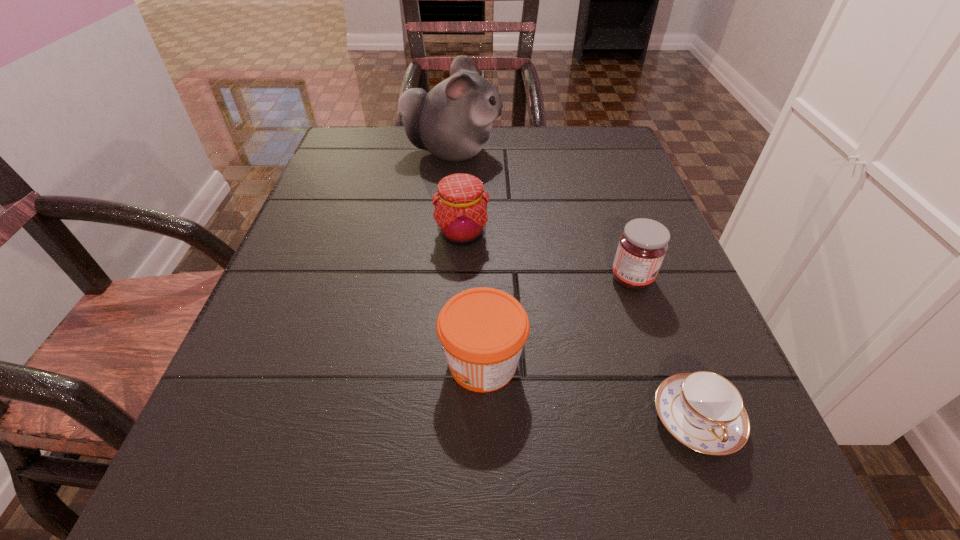
At what (x,y) coordinates should I click in order to perform the action: click on the tallest object. Please return your answer as a coordinate pair (x, y). Image resolution: width=960 pixels, height=540 pixels. Looking at the image, I should click on (452, 121).

The width and height of the screenshot is (960, 540). Identify the location of hamster. (452, 121).

The height and width of the screenshot is (540, 960). In order to click on the second farthest object in this screenshot , I will do `click(460, 212)`.

Identify the location of the second farthest jam. (642, 246).

Where is `the third nearest object`? The height and width of the screenshot is (540, 960). the third nearest object is located at coordinates (642, 246).

What are the coordinates of `the nearest jam` in the screenshot? It's located at (482, 330).

Find the location of `the shortest object`. the shortest object is located at coordinates (703, 410).

At what (x,y) coordinates should I click in order to perform the action: click on free space located 0.290m on the face of the hamster. Please return your answer as a coordinate pair (x, y). This screenshot has width=960, height=540. Looking at the image, I should click on (625, 152).

In order to click on blank space located 0.270m on the front of the fourth nearest object in this screenshot , I will do `click(455, 386)`.

You are a GUI agent. You are given a task and a screenshot of the screen. Output one action in this format:
    pyautogui.click(x=<x>, y=<y>)
    Task: Click on the free region located on the back of the rightmost jam
    The height and width of the screenshot is (540, 960).
    Given the screenshot: What is the action you would take?
    pyautogui.click(x=598, y=181)